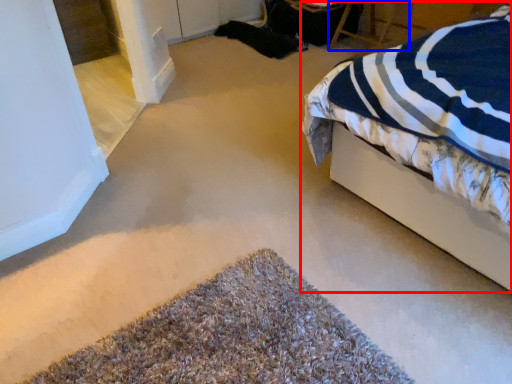
Question: Which object is further to the camera taking this photo, bed (highlighted by a red box) or chair (highlighted by a blue box)?

Choices:
 (A) bed
 (B) chair

Answer: (B)